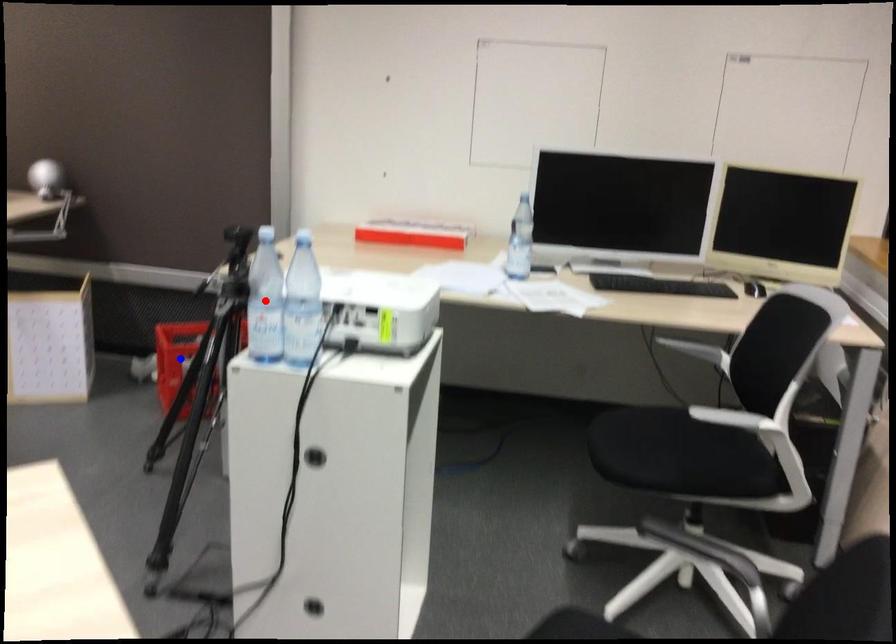
Question: Which of the two points in the image is closer to the camera?

Choices:
 (A) Blue point is closer.
 (B) Red point is closer.

Answer: (B)